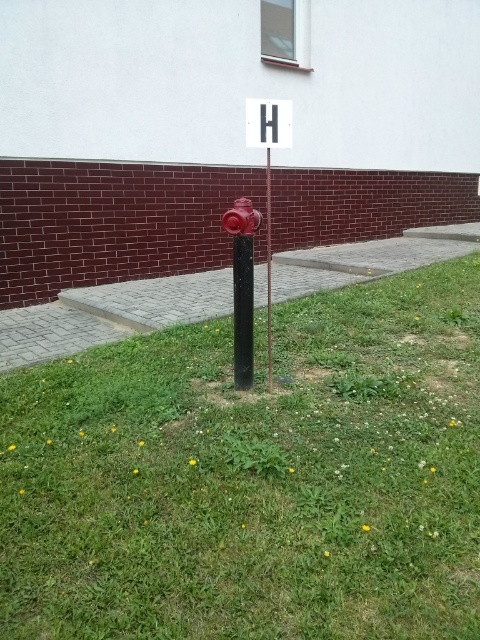
Can you confirm if green grass at center is positioned to the left of glossy red fire hydrant at center?

Incorrect, green grass at center is not on the left side of glossy red fire hydrant at center.

Image resolution: width=480 pixels, height=640 pixels. In order to click on green grass at center in this screenshot , I will do `click(253, 477)`.

Between point (232, 236) and point (269, 284), which one is positioned behind?

The point (269, 284) is behind.

Is shiny red hydrant at center to the left of black matte pole at center from the viewer's perspective?

Correct, you'll find shiny red hydrant at center to the left of black matte pole at center.

This screenshot has height=640, width=480. What are the coordinates of `shiny red hydrant at center` in the screenshot? It's located at (242, 285).

The height and width of the screenshot is (640, 480). I want to click on shiny red hydrant at center, so click(242, 285).

Does point (251, 433) come behind point (271, 268)?

No, (251, 433) is in front of (271, 268).

This screenshot has height=640, width=480. What are the coordinates of `green grass at center` in the screenshot? It's located at (253, 477).